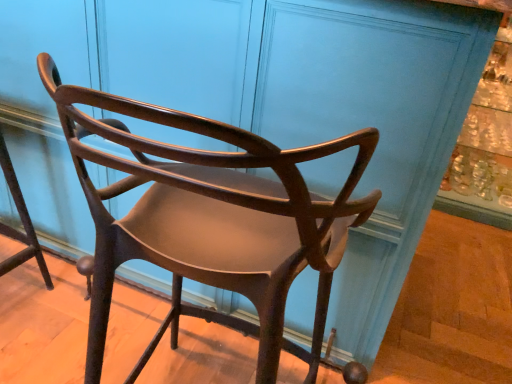
Describe the element at coordinates (211, 220) in the screenshot. I see `matte brown chair at center` at that location.

Image resolution: width=512 pixels, height=384 pixels. I want to click on matte brown chair at center, so click(211, 220).

Where is `matte brown chair at center`? The width and height of the screenshot is (512, 384). matte brown chair at center is located at coordinates (211, 220).